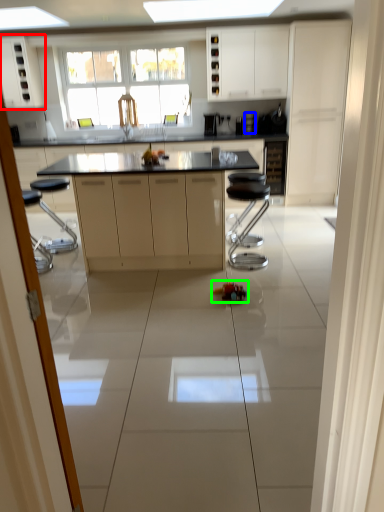
Question: Estimate the real-world distances between objects in this image. Which object is farther from cabinetry (highlighted by a red box), appliance (highlighted by a blue box) or toy (highlighted by a green box)?

Choices:
 (A) appliance
 (B) toy

Answer: (B)